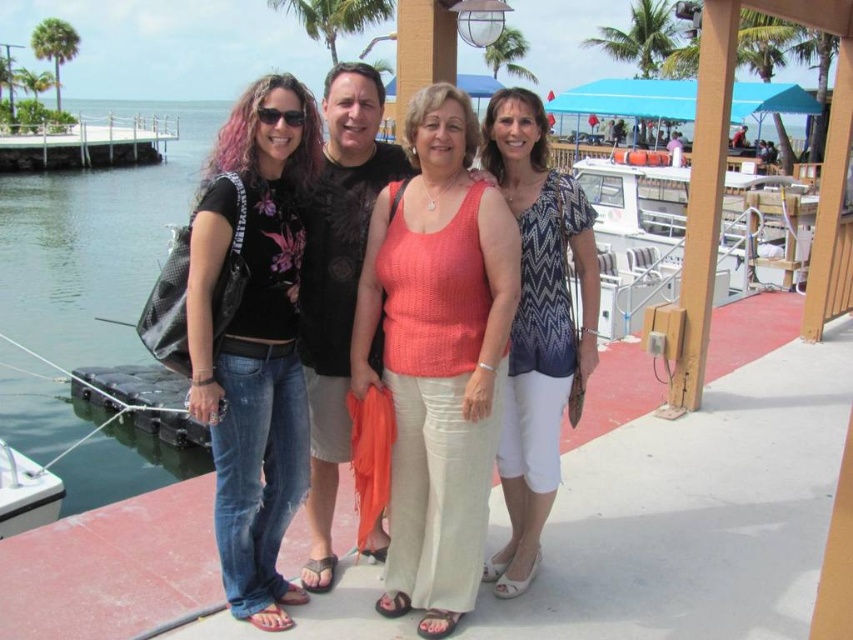
You are a photographer trying to capture a photo of the knitted coral tank top at center and the transparent plastic water at left. The camera you are using has a maximum focus range of 10 meters. Will you be able to focus on both objects simultaneously?

The knitted coral tank top at center is 10.81 meters from the transparent plastic water at left. Since the distance between them exceeds the camera maximum focus range of 10 meters, the camera cannot focus on both objects at the same time.

You are a photographer trying to adjust the composition of the group photo. You want to ensure that the matte black shirt at center and the denim jeans at left are aligned properly. Which object should be moved to the left to make them align horizontally?

The matte black shirt at center should be moved to the left to align it with the denim jeans at left since it is currently positioned to the right of the denim jeans at left.